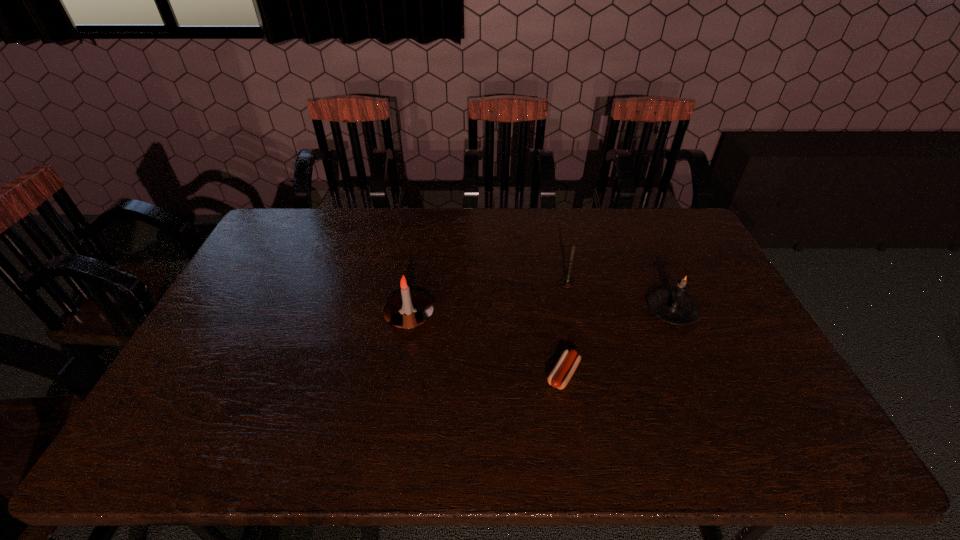
Locate an element on the screen. vacant space that satisfies the following two spatial constraints: 1. on the back side of the nearest object; 2. on the left side of the rightmost object is located at coordinates (553, 311).